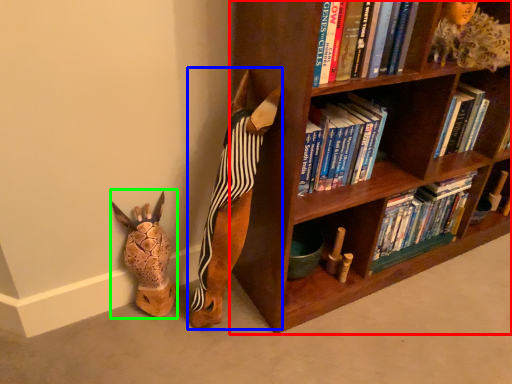
Question: Considering the real-world distances, which object is closest to bookcase (highlighted by a red box)? animal (highlighted by a blue box) or animal (highlighted by a green box).

Choices:
 (A) animal
 (B) animal

Answer: (A)